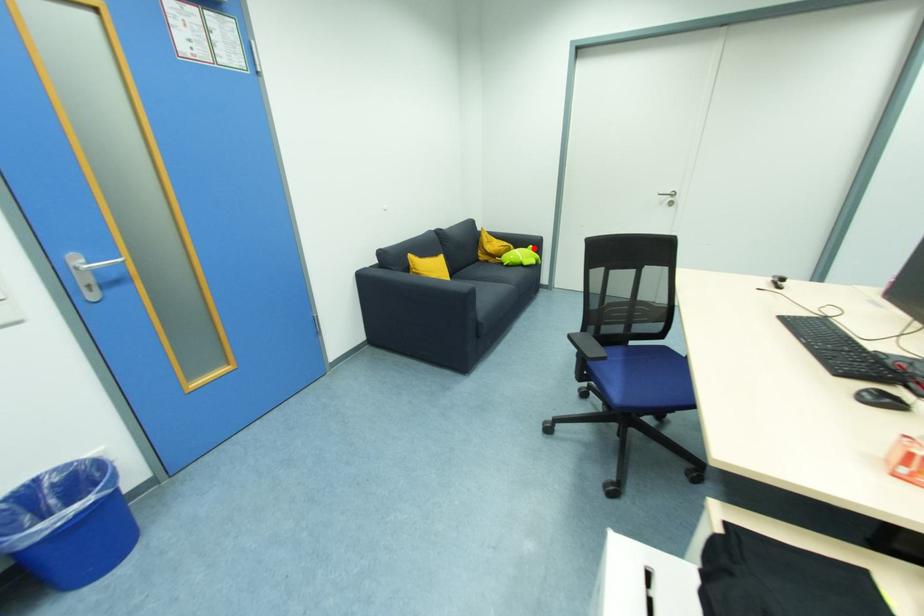
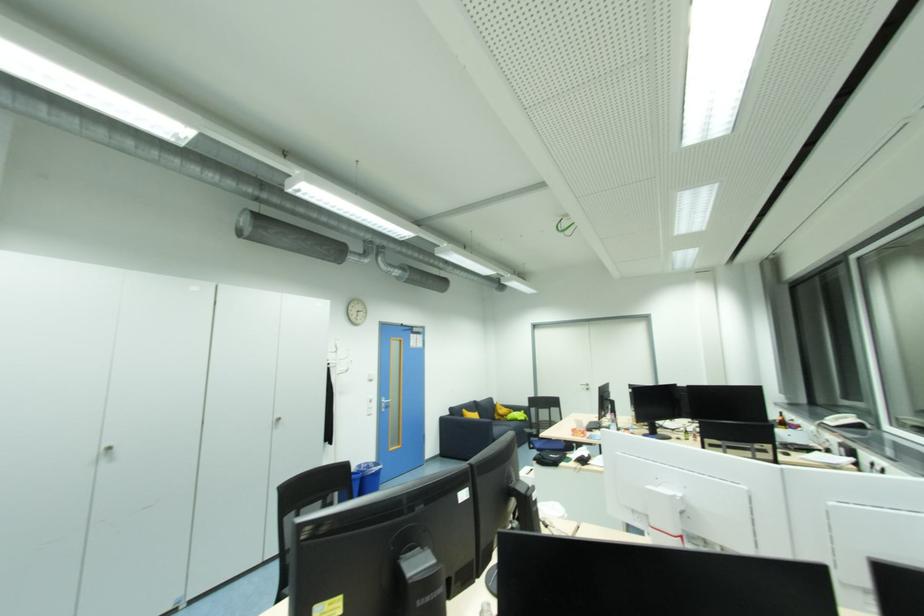
Question: I am providing you with two images of the same scene from different viewpoints. A red point is shown in image1. For the corresponding object point in image2, is it positioned nearer or farther from the camera?

Choices:
 (A) Nearer
 (B) Farther

Answer: (B)